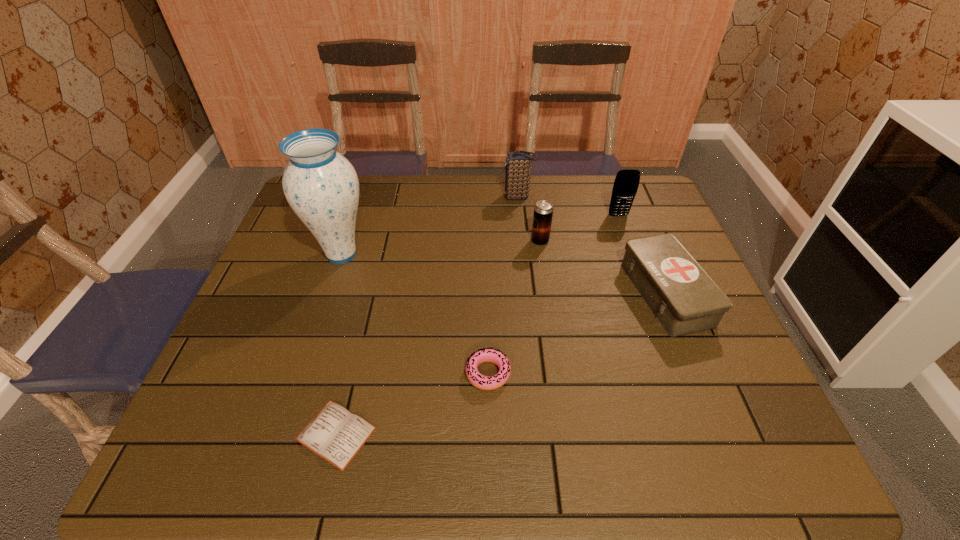
The image size is (960, 540). I want to click on vacant region located 0.200m with the zip open on the clutch bag, so click(443, 197).

The height and width of the screenshot is (540, 960). In order to click on vacant space located 0.110m with the zip open on the clutch bag in this screenshot , I will do `click(469, 197)`.

Find the location of a particular element. vacant space located 0.210m with the zip open on the clutch bag is located at coordinates [439, 197].

The width and height of the screenshot is (960, 540). I want to click on vacant space located on the screen of the sixth nearest object, so click(x=652, y=307).

You are a GUI agent. You are given a task and a screenshot of the screen. Output one action in this format:
    pyautogui.click(x=<x>, y=<y>)
    Task: Click on the vacant region located 0.090m on the front of the beer can
    
    Given the screenshot: What is the action you would take?
    pyautogui.click(x=544, y=268)

Find the location of a particular element. This screenshot has height=540, width=960. free space located 0.090m on the back of the third shortest object is located at coordinates (642, 236).

Where is `free location located on the right of the third object from left to right`? free location located on the right of the third object from left to right is located at coordinates (600, 374).

The height and width of the screenshot is (540, 960). What are the coordinates of `vacant position located on the back of the shortest object` in the screenshot? It's located at (355, 354).

Locate an element on the screen. Image resolution: width=960 pixels, height=540 pixels. clutch bag that is at the far edge is located at coordinates click(x=518, y=164).

The height and width of the screenshot is (540, 960). I want to click on cellular telephone that is positioned at the far edge, so click(x=626, y=183).